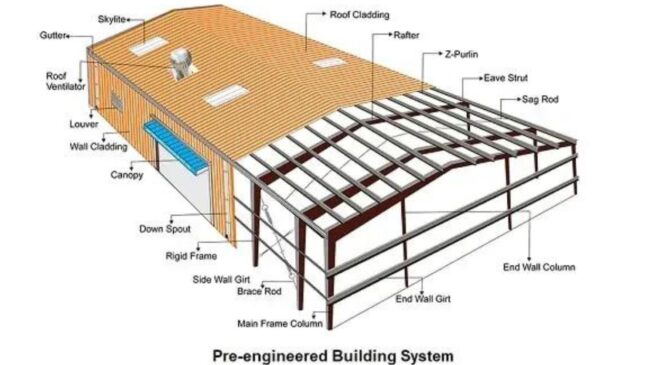
At what (x,y) coordinates should I click in order to perform the action: click on vent. Please return your answer as a coordinate pair (x, y). Image resolution: width=650 pixels, height=365 pixels. Looking at the image, I should click on (242, 89).